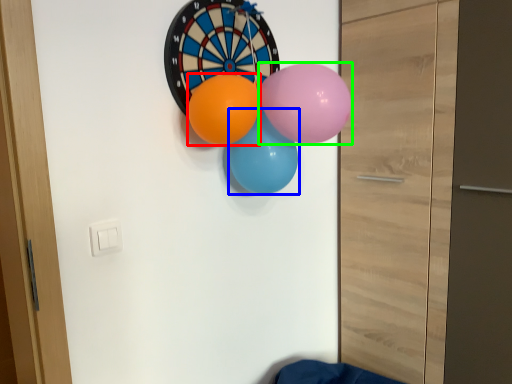
Question: Which object is positioned closest to balloon (highlighted by a red box)? Select from balloon (highlighted by a blue box) and balloon (highlighted by a green box).

Choices:
 (A) balloon
 (B) balloon

Answer: (A)